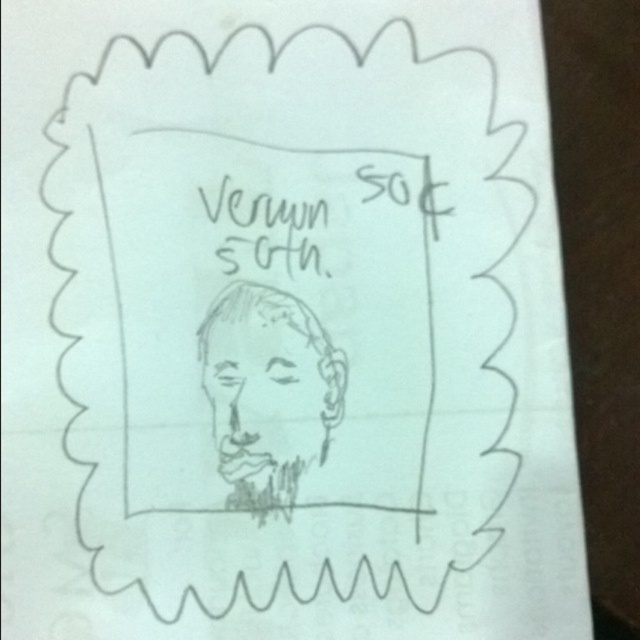
Question: Which point appears farthest from the camera in this image?

Choices:
 (A) (253, 307)
 (B) (218, 200)

Answer: (B)

Question: Does sketchy pencil man at center appear over black ink writing at center?

Choices:
 (A) yes
 (B) no

Answer: (B)

Question: Is sketchy pencil man at center above black ink writing at center?

Choices:
 (A) yes
 (B) no

Answer: (B)

Question: Which point appears farthest from the camera in this image?

Choices:
 (A) (200, 193)
 (B) (259, 310)

Answer: (A)

Question: Among these objects, which one is farthest from the camera?

Choices:
 (A) black ink writing at center
 (B) sketchy pencil man at center

Answer: (A)

Question: Is sketchy pencil man at center closer to camera compared to black ink writing at center?

Choices:
 (A) yes
 (B) no

Answer: (A)